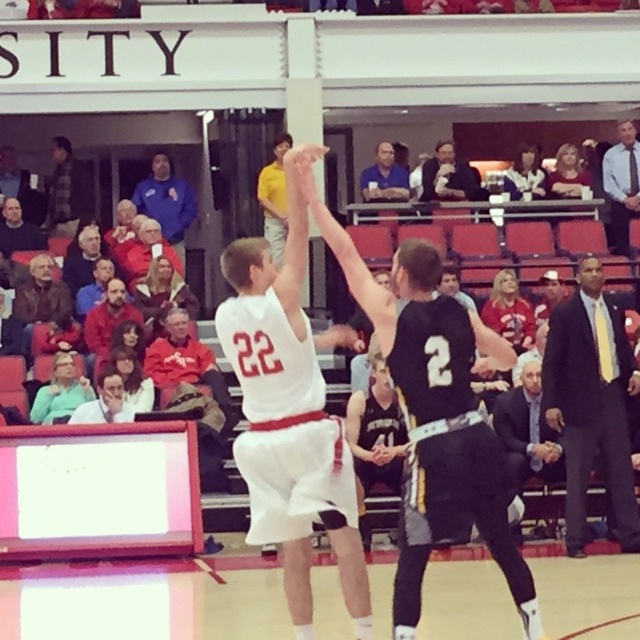
Question: From the image, what is the correct spatial relationship of light blue shirt at upper right in relation to light brown leather jacket at center?

Choices:
 (A) right
 (B) left

Answer: (A)

Question: Which of the following is the farthest from the observer?

Choices:
 (A) (397, 182)
 (B) (96, 410)
 (C) (620, 129)

Answer: (C)

Question: Which is nearer to the light blue shirt at upper right?

Choices:
 (A) dark suit at right
 (B) blue shirt at upper center

Answer: (B)

Question: Does dark suit at right have a larger size compared to light brown leather jacket at center?

Choices:
 (A) yes
 (B) no

Answer: (A)

Question: Is white matte jersey at center below matte black jacket at left?

Choices:
 (A) no
 (B) yes

Answer: (B)

Question: Which of the following is the farthest from the observer?

Choices:
 (A) blue shirt at upper center
 (B) light brown leather jacket at center
 (C) black jersey at center

Answer: (A)